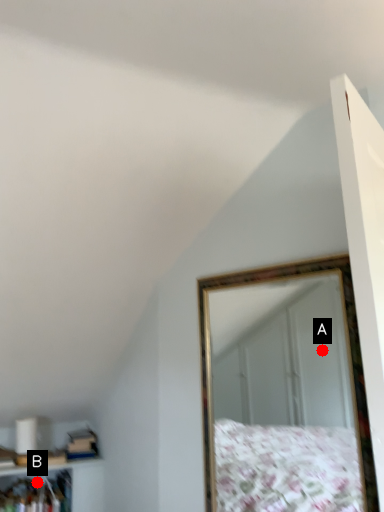
Question: Two points are circled on the image, labeled by A and B beside each circle. Which point is closer to the camera taking this photo?

Choices:
 (A) A is closer
 (B) B is closer

Answer: (B)